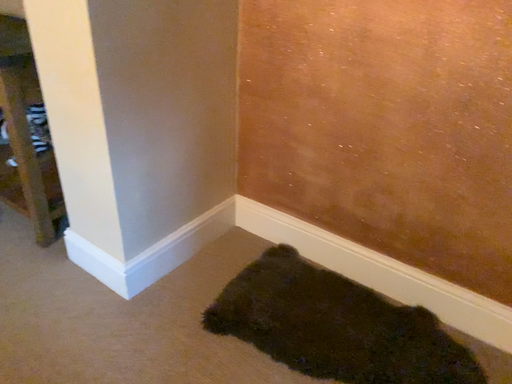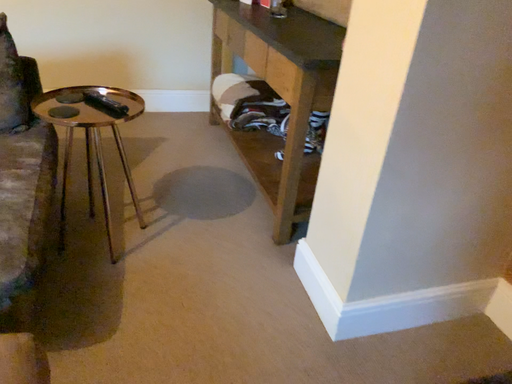
Question: How did the camera likely rotate when shooting the video?

Choices:
 (A) rotated left
 (B) rotated right

Answer: (A)